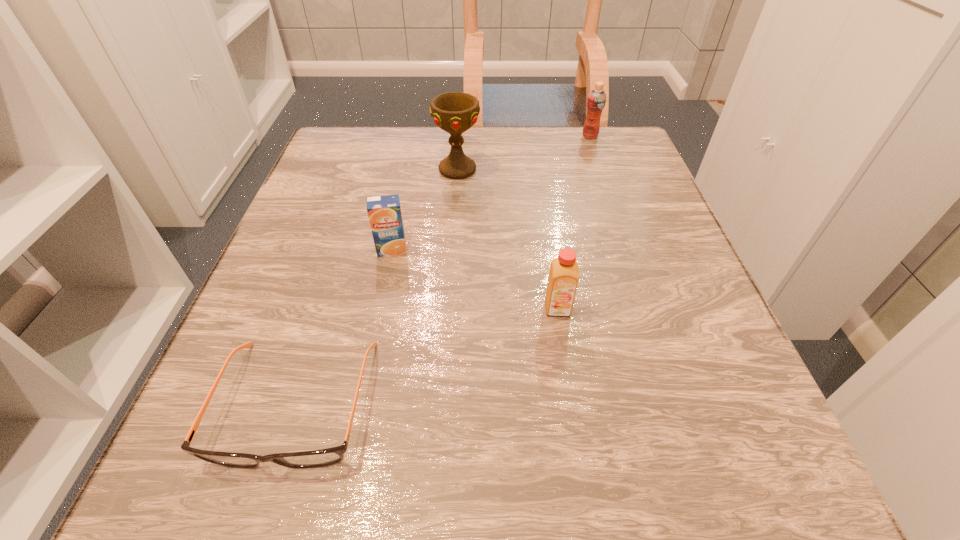
Locate an element on the screen. The height and width of the screenshot is (540, 960). chalice is located at coordinates (454, 112).

This screenshot has height=540, width=960. I want to click on the third object from right to left, so click(x=454, y=112).

Where is `the farthest orange_juice`? The width and height of the screenshot is (960, 540). the farthest orange_juice is located at coordinates (596, 100).

Find the location of a particular element. This screenshot has width=960, height=540. the farthest object is located at coordinates (596, 100).

The width and height of the screenshot is (960, 540). In order to click on the second orange_juice from right to left in this screenshot , I will do `click(563, 279)`.

Where is `the nearest orange_juice`? Image resolution: width=960 pixels, height=540 pixels. the nearest orange_juice is located at coordinates (563, 279).

The width and height of the screenshot is (960, 540). What are the coordinates of `the third nearest object` in the screenshot? It's located at (384, 212).

Where is `the second nearest orange_juice`? the second nearest orange_juice is located at coordinates (384, 212).

Locate an element on the screen. The image size is (960, 540). the nearest object is located at coordinates (317, 458).

Where is `spectacles`? spectacles is located at coordinates [317, 458].